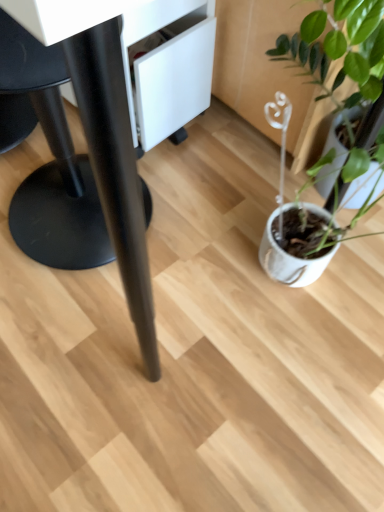
Question: From a real-world perspective, does white matte pot at right stand above black matte table at center?

Choices:
 (A) no
 (B) yes

Answer: (A)

Question: Considering the relative sizes of white matte pot at right and black matte table at center in the image provided, is white matte pot at right taller than black matte table at center?

Choices:
 (A) no
 (B) yes

Answer: (A)

Question: Is white matte pot at right in front of black matte table at center?

Choices:
 (A) yes
 (B) no

Answer: (B)

Question: Is white matte pot at right facing towards black matte table at center?

Choices:
 (A) yes
 (B) no

Answer: (B)

Question: Considering the relative sizes of white matte pot at right and black matte table at center in the image provided, is white matte pot at right shorter than black matte table at center?

Choices:
 (A) no
 (B) yes

Answer: (B)

Question: From the image's perspective, is black matte table at center above or below white matte pot at right?

Choices:
 (A) above
 (B) below

Answer: (A)

Question: Is point (92, 155) closer or farther from the camera than point (276, 210)?

Choices:
 (A) closer
 (B) farther

Answer: (A)

Question: In terms of width, does black matte table at center look wider or thinner when compared to white matte pot at right?

Choices:
 (A) wide
 (B) thin

Answer: (A)

Question: In the image, is black matte table at center positioned in front of or behind white matte pot at right?

Choices:
 (A) front
 (B) behind

Answer: (A)

Question: In the image, is black matte swivel chair at left positioned in front of or behind white matte pot at right?

Choices:
 (A) behind
 (B) front

Answer: (B)

Question: Considering the positions of black matte swivel chair at left and white matte pot at right in the image, is black matte swivel chair at left taller or shorter than white matte pot at right?

Choices:
 (A) short
 (B) tall

Answer: (B)

Question: Does point (31, 236) appear closer or farther from the camera than point (377, 40)?

Choices:
 (A) closer
 (B) farther

Answer: (B)

Question: Do you think black matte swivel chair at left is within white matte pot at right, or outside of it?

Choices:
 (A) outside
 (B) inside

Answer: (A)

Question: From a real-world perspective, is white matte pot at right physically located above or below black matte swivel chair at left?

Choices:
 (A) above
 (B) below

Answer: (B)

Question: Looking at their shapes, would you say white matte pot at right is wider or thinner than black matte swivel chair at left?

Choices:
 (A) thin
 (B) wide

Answer: (A)